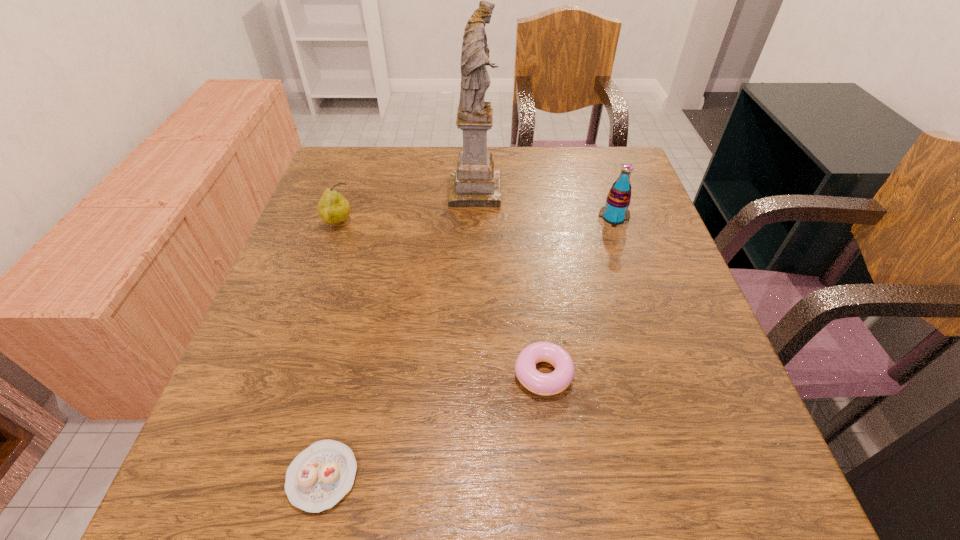
The width and height of the screenshot is (960, 540). In order to click on free spot between the third object from left to right and the second tallest object in this screenshot , I will do `click(544, 205)`.

The image size is (960, 540). What are the coordinates of `empty location between the third tallest object and the fourth shortest object` in the screenshot? It's located at (476, 221).

I want to click on blank region between the cupcake and the third object from right to left, so click(x=398, y=334).

Locate an element on the screen. This screenshot has width=960, height=540. unoccupied area between the fourth farthest object and the sculpture is located at coordinates (509, 282).

At what (x,y) coordinates should I click in order to perform the action: click on free space that is in between the soda and the farthest object. Please return your answer as a coordinate pair (x, y). This screenshot has width=960, height=540. Looking at the image, I should click on (544, 205).

The image size is (960, 540). I want to click on free space that is in between the second nearest object and the leftmost object, so click(441, 298).

Locate an element on the screen. This screenshot has height=540, width=960. free space that is in between the cupcake and the soda is located at coordinates (468, 347).

Identify the location of the third closest object to the rightmost object. (333, 208).

Locate which object ranks second in proximity to the pear. Please provide its 2D coordinates. Your answer should be formatted as a tuple, i.e. [(x, y)], where the tuple contains the x and y coordinates of a point satisfying the conditions above.

[(557, 381)]

I want to click on free spot that satisfies the following two spatial constraints: 1. on the back side of the soda; 2. on the right side of the second object from right to left, so click(525, 218).